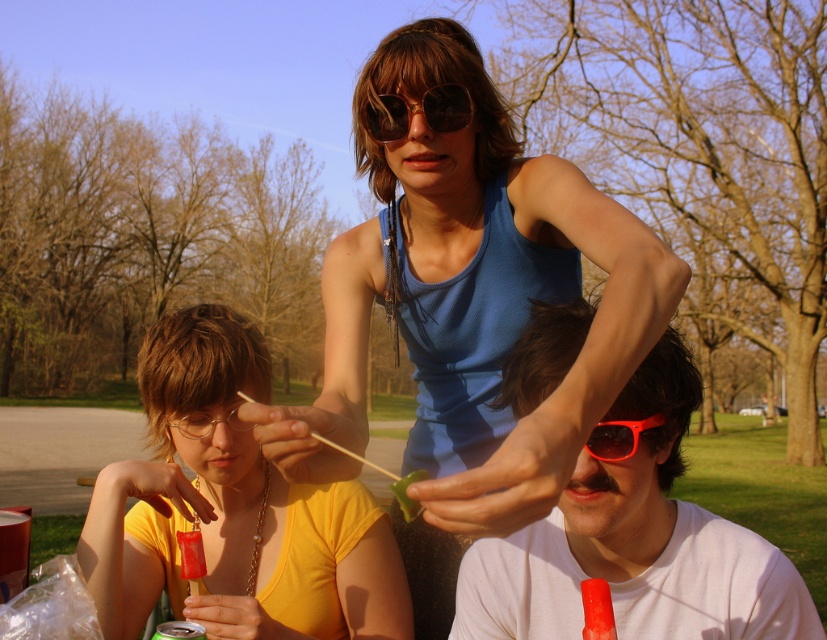
Between yellow matte shirt at lower left and sunglasses at center, which one is positioned lower?

yellow matte shirt at lower left is below.

Between yellow matte shirt at lower left and sunglasses at center, which one has less height?

With less height is sunglasses at center.

Is point (281, 576) closer to viewer compared to point (418, 108)?

No.

Locate an element on the screen. yellow matte shirt at lower left is located at coordinates (230, 509).

Can you confirm if blue tank top at center is positioned to the left of sunglasses at center?

Incorrect, blue tank top at center is not on the left side of sunglasses at center.

This screenshot has width=827, height=640. I want to click on blue tank top at center, so click(467, 310).

Who is more forward, (495, 221) or (366, 115)?

Point (366, 115)

At what (x,y) coordinates should I click in order to perform the action: click on blue tank top at center. Please return your answer as a coordinate pair (x, y). This screenshot has height=640, width=827. Looking at the image, I should click on (467, 310).

Is blue tank top at center to the right of red plastic sunglasses at upper center from the viewer's perspective?

No, blue tank top at center is not to the right of red plastic sunglasses at upper center.

Between blue tank top at center and red plastic sunglasses at upper center, which one is positioned higher?

blue tank top at center is higher up.

The height and width of the screenshot is (640, 827). What are the coordinates of `blue tank top at center` in the screenshot? It's located at [x=467, y=310].

The image size is (827, 640). What are the coordinates of `blue tank top at center` in the screenshot? It's located at (467, 310).